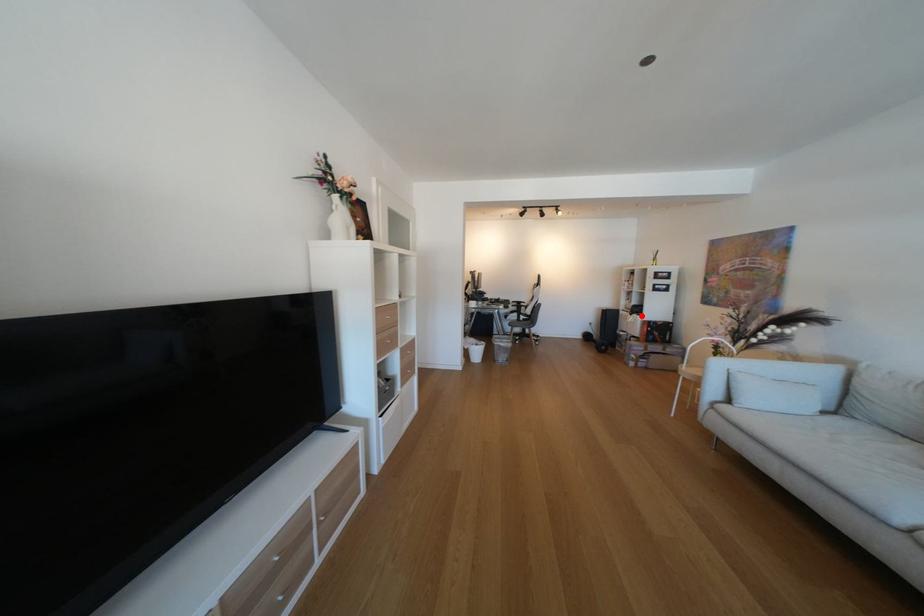
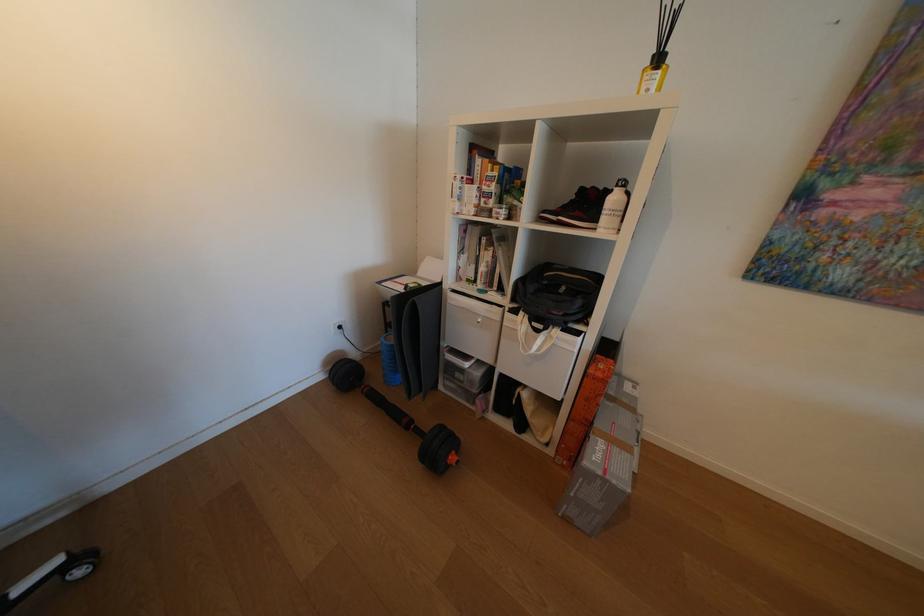
Question: I am providing you with two images of the same scene from different viewpoints. In image1, a red point is highlighted. Considering the same 3D point in image2, which of the following is correct?

Choices:
 (A) It is closer
 (B) It is farther

Answer: (B)